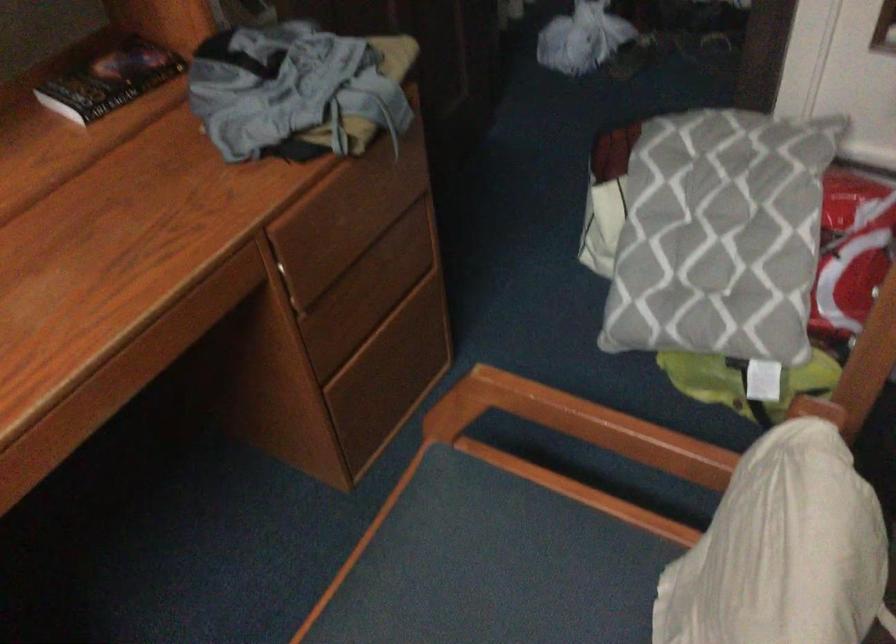
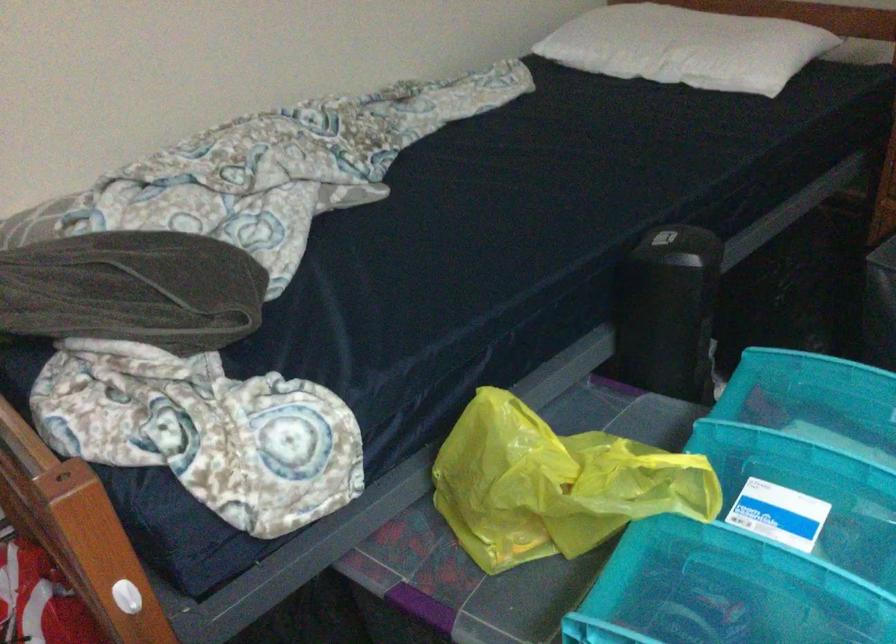
Question: Based on the continuous images, in which direction is the camera rotating? Reply with the corresponding letter.

Choices:
 (A) Left
 (B) Right
 (C) Up
 (D) Down

Answer: (B)